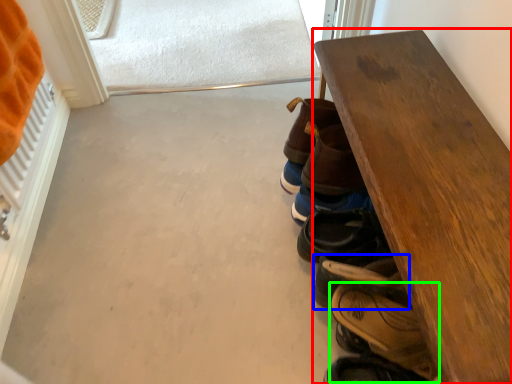
Question: Estimate the real-world distances between objects in this image. Which object is farther from table (highlighted by a red box), footwear (highlighted by a blue box) or footwear (highlighted by a green box)?

Choices:
 (A) footwear
 (B) footwear

Answer: (B)